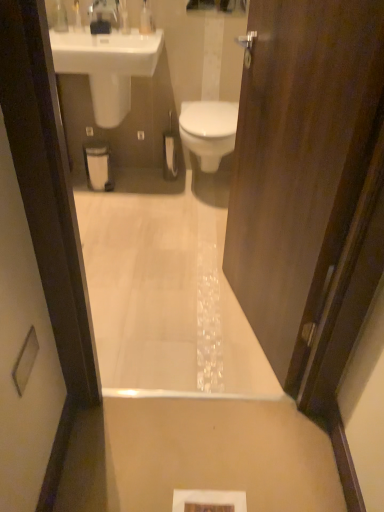
Question: Is the depth of translucent plastic soap dispenser at upper center, arranged as the second toiletry when viewed from the right, less than that of clear plastic bottle at upper left, placed as the 1th toiletry when sorted from left to right?

Choices:
 (A) no
 (B) yes

Answer: (A)

Question: From a real-world perspective, is translucent plastic soap dispenser at upper center, arranged as the second toiletry when viewed from the right, positioned under clear plastic bottle at upper left, which appears as the third toiletry when viewed from the right, based on gravity?

Choices:
 (A) no
 (B) yes

Answer: (B)

Question: From the image's perspective, is translucent plastic soap dispenser at upper center, arranged as the second toiletry when viewed from the right, on clear plastic bottle at upper left, placed as the 1th toiletry when sorted from left to right?

Choices:
 (A) no
 (B) yes

Answer: (A)

Question: Does translucent plastic soap dispenser at upper center, the 2th toiletry viewed from the left, appear on the left side of clear plastic bottle at upper left, placed as the 1th toiletry when sorted from left to right?

Choices:
 (A) yes
 (B) no

Answer: (B)

Question: Is translucent plastic soap dispenser at upper center, arranged as the second toiletry when viewed from the right, taller than clear plastic bottle at upper left, placed as the 1th toiletry when sorted from left to right?

Choices:
 (A) yes
 (B) no

Answer: (B)

Question: From the image's perspective, is white glossy bidet at center located above or below glossy glass mirror at upper center?

Choices:
 (A) above
 (B) below

Answer: (B)

Question: Considering their positions, is white glossy bidet at center located in front of or behind glossy glass mirror at upper center?

Choices:
 (A) behind
 (B) front

Answer: (B)

Question: From a real-world perspective, is white glossy bidet at center above or below glossy glass mirror at upper center?

Choices:
 (A) above
 (B) below

Answer: (B)

Question: Is white glossy bidet at center bigger or smaller than glossy glass mirror at upper center?

Choices:
 (A) big
 (B) small

Answer: (A)

Question: Does point click(x=238, y=1) appear closer or farther from the camera than point click(x=124, y=30)?

Choices:
 (A) closer
 (B) farther

Answer: (A)

Question: From a real-world perspective, is glossy glass mirror at upper center above or below translucent plastic soap dispenser at upper center, the 2th toiletry viewed from the left?

Choices:
 (A) above
 (B) below

Answer: (A)

Question: Is glossy glass mirror at upper center inside or outside of translucent plastic soap dispenser at upper center, the 2th toiletry viewed from the left?

Choices:
 (A) inside
 (B) outside

Answer: (B)

Question: From their relative heights in the image, would you say glossy glass mirror at upper center is taller or shorter than translucent plastic soap dispenser at upper center, arranged as the second toiletry when viewed from the right?

Choices:
 (A) tall
 (B) short

Answer: (A)

Question: Is point (292, 224) closer or farther from the camera than point (145, 7)?

Choices:
 (A) farther
 (B) closer

Answer: (B)

Question: From a real-world perspective, relative to clear plastic bottle at upper center, arranged as the third toiletry when viewed from the left, is dark wood door at center vertically above or below?

Choices:
 (A) above
 (B) below

Answer: (B)